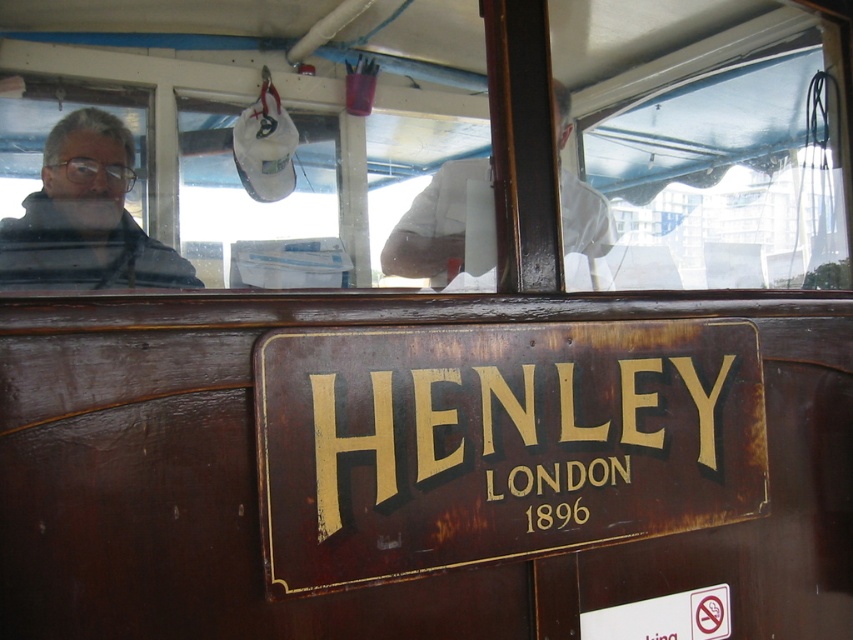
Question: Which object is farther from the camera taking this photo?

Choices:
 (A) gray matte jacket at left
 (B) transparent glass window at center

Answer: (A)

Question: Can you confirm if transparent glass window at center is wider than gray matte jacket at left?

Choices:
 (A) no
 (B) yes

Answer: (B)

Question: Can you confirm if rusty metal sign at center is thinner than white cloth at upper center?

Choices:
 (A) no
 (B) yes

Answer: (A)

Question: Which object is positioned farthest from the gray matte jacket at left?

Choices:
 (A) rusty metal sign at center
 (B) white cloth at upper center
 (C) transparent glass window at center

Answer: (C)

Question: Is gray matte jacket at left in front of white cloth at upper center?

Choices:
 (A) no
 (B) yes

Answer: (A)

Question: Which of the following is the farthest from the observer?

Choices:
 (A) white cloth at upper center
 (B) rusty metal sign at center
 (C) transparent glass window at center
 (D) gray matte jacket at left

Answer: (D)